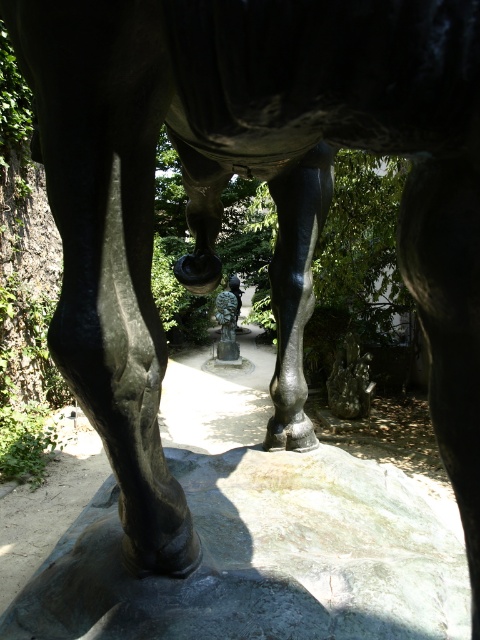
Is green stone at center shorter than bronze statue at center?

Indeed, green stone at center has a lesser height compared to bronze statue at center.

Is point (217, 589) in front of point (232, 296)?

Yes, point (217, 589) is in front of point (232, 296).

The image size is (480, 640). I want to click on green stone at center, so click(x=262, y=560).